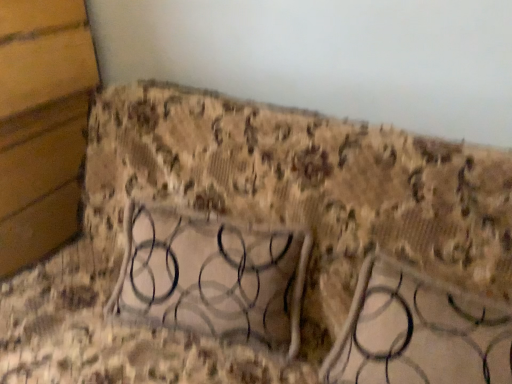
The width and height of the screenshot is (512, 384). What do you see at coordinates (41, 124) in the screenshot?
I see `metallic textured frame at lower left` at bounding box center [41, 124].

In order to face metallic textured frame at lower left, should I rotate leftwards or rightwards?

Rotate your view left by about 29.561°.

Locate an element on the screen. metallic textured frame at lower left is located at coordinates (41, 124).

Identify the location of metallic silver table at center. (418, 332).

Describe the element at coordinates (418, 332) in the screenshot. I see `metallic silver table at center` at that location.

This screenshot has width=512, height=384. I want to click on metallic textured frame at lower left, so click(41, 124).

Which is more to the right, metallic silver table at center or metallic textured frame at lower left?

metallic silver table at center is more to the right.

Is the depth of metallic silver table at center less than that of metallic textured frame at lower left?

That is True.

Which is behind, point (408, 374) or point (85, 9)?

Positioned behind is point (85, 9).

From the picture: From the image's perspective, would you say metallic silver table at center is positioned over metallic textured frame at lower left?

Incorrect, from the image's perspective, metallic silver table at center is lower than metallic textured frame at lower left.

From a real-world perspective, is metallic silver table at center below metallic textured frame at lower left?

Yes, from a real-world perspective, metallic silver table at center is under metallic textured frame at lower left.

Can you confirm if metallic silver table at center is thinner than metallic textured frame at lower left?

Yes.

Between metallic silver table at center and metallic textured frame at lower left, which one has more height?

metallic textured frame at lower left is taller.

Which of these two, metallic silver table at center or metallic textured frame at lower left, is smaller?

metallic silver table at center is smaller.

Is metallic textured frame at lower left surrounded by metallic silver table at center?

That's incorrect, metallic textured frame at lower left is not inside metallic silver table at center.

Is metallic silver table at center in contact with metallic textured frame at lower left?

No, metallic silver table at center is not in contact with metallic textured frame at lower left.

In the scene shown: Is metallic silver table at center aimed at metallic textured frame at lower left?

No, metallic silver table at center is not facing towards metallic textured frame at lower left.

Measure the distance from metallic silver table at center to metallic textured frame at lower left.

metallic silver table at center and metallic textured frame at lower left are 4.01 feet apart.

At what (x,y) coordinates should I click in order to perform the action: click on panel above the metallic silver table at center (from a real-world perspective). Please return your answer as a coordinate pair (x, y). Looking at the image, I should click on (41, 124).

Based on their positions, is metallic textured frame at lower left located to the left or right of metallic silver table at center?

metallic textured frame at lower left is to the left of metallic silver table at center.

Who is more distant, metallic textured frame at lower left or metallic silver table at center?

metallic textured frame at lower left is further from the camera.

Is point (70, 181) farther from camera compared to point (430, 304)?

Yes, point (70, 181) is farther from viewer.

From the image's perspective, is metallic textured frame at lower left on metallic silver table at center?

Yes, from the image's perspective, metallic textured frame at lower left is over metallic silver table at center.

From a real-world perspective, which is physically below, metallic textured frame at lower left or metallic silver table at center?

In real-world perspective, metallic silver table at center is lower.

Considering the sizes of objects metallic textured frame at lower left and metallic silver table at center in the image provided, who is thinner, metallic textured frame at lower left or metallic silver table at center?

With smaller width is metallic silver table at center.

Does metallic textured frame at lower left have a lesser height compared to metallic silver table at center?

Incorrect, the height of metallic textured frame at lower left does not fall short of that of metallic silver table at center.

Considering the sizes of objects metallic textured frame at lower left and metallic silver table at center in the image provided, who is smaller, metallic textured frame at lower left or metallic silver table at center?

With smaller size is metallic silver table at center.

Is metallic textured frame at lower left inside the boundaries of metallic silver table at center, or outside?

metallic textured frame at lower left is located beyond the bounds of metallic silver table at center.

Is metallic textured frame at lower left far from metallic silver table at center?

metallic textured frame at lower left is far away from metallic silver table at center.

Looking at this image, is metallic textured frame at lower left looking in the opposite direction of metallic silver table at center?

metallic textured frame at lower left does not have its back to metallic silver table at center.

Find the location of `furniture on the right of metallic textured frame at lower left`. furniture on the right of metallic textured frame at lower left is located at coordinates (418, 332).

This screenshot has width=512, height=384. I want to click on panel above the metallic silver table at center (from a real-world perspective), so click(x=41, y=124).

You are a GUI agent. You are given a task and a screenshot of the screen. Output one action in this format:
    pyautogui.click(x=<x>, y=<y>)
    Task: Click on the furniture that appears in front of the metallic textured frame at lower left
    The width and height of the screenshot is (512, 384).
    Given the screenshot: What is the action you would take?
    pyautogui.click(x=418, y=332)